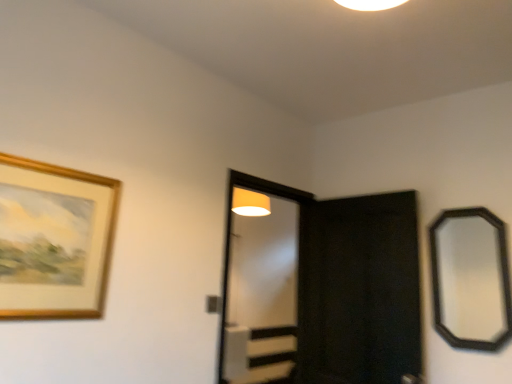
Question: Can you confirm if black matte screen door at center, placed as the 1th screen door when sorted from right to left, is wider than black wooden mirror at right?

Choices:
 (A) no
 (B) yes

Answer: (B)

Question: Does black matte screen door at center, marked as the second screen door in a left-to-right arrangement, appear on the left side of black wooden mirror at right?

Choices:
 (A) no
 (B) yes

Answer: (B)

Question: Is the depth of black matte screen door at center, marked as the second screen door in a left-to-right arrangement, less than that of black wooden mirror at right?

Choices:
 (A) no
 (B) yes

Answer: (A)

Question: Is black matte screen door at center, placed as the 1th screen door when sorted from right to left, positioned beyond the bounds of black wooden mirror at right?

Choices:
 (A) no
 (B) yes

Answer: (B)

Question: Does black matte screen door at center, placed as the 1th screen door when sorted from right to left, contain black wooden mirror at right?

Choices:
 (A) yes
 (B) no

Answer: (B)

Question: Based on their sizes in the image, would you say black wooden mirror at right is bigger or smaller than gold wooden picture frame at upper left?

Choices:
 (A) small
 (B) big

Answer: (B)

Question: Is black wooden mirror at right spatially inside gold wooden picture frame at upper left, or outside of it?

Choices:
 (A) inside
 (B) outside

Answer: (B)

Question: Would you say black wooden mirror at right is to the left or to the right of gold wooden picture frame at upper left in the picture?

Choices:
 (A) right
 (B) left

Answer: (A)

Question: Considering the positions of black wooden mirror at right and gold wooden picture frame at upper left in the image, is black wooden mirror at right wider or thinner than gold wooden picture frame at upper left?

Choices:
 (A) thin
 (B) wide

Answer: (B)

Question: Is gold wooden picture frame at upper left inside or outside of clear glass screen door at center, which is counted as the 2th screen door, starting from the right?

Choices:
 (A) outside
 (B) inside

Answer: (A)

Question: Visually, is gold wooden picture frame at upper left positioned to the left or to the right of clear glass screen door at center, which is counted as the 2th screen door, starting from the right?

Choices:
 (A) left
 (B) right

Answer: (A)

Question: From the image's perspective, is gold wooden picture frame at upper left positioned above or below clear glass screen door at center, which is counted as the 2th screen door, starting from the right?

Choices:
 (A) above
 (B) below

Answer: (A)

Question: Does point (83, 304) appear closer or farther from the camera than point (232, 271)?

Choices:
 (A) farther
 (B) closer

Answer: (B)

Question: Is point (282, 236) positioned closer to the camera than point (6, 165)?

Choices:
 (A) closer
 (B) farther

Answer: (B)

Question: From the image's perspective, is clear glass screen door at center, which is counted as the 2th screen door, starting from the right, located above or below gold wooden picture frame at upper left?

Choices:
 (A) above
 (B) below

Answer: (B)